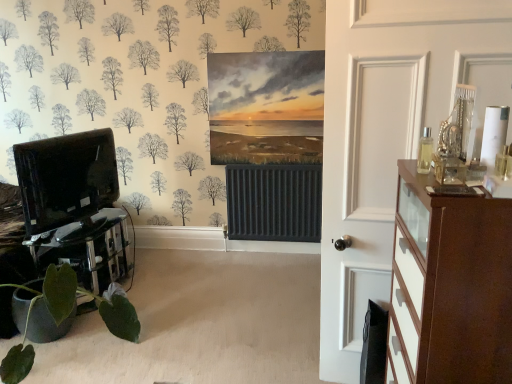
Question: Can you confirm if black glass table at lower left is wider than green matte plant at lower left?

Choices:
 (A) no
 (B) yes

Answer: (A)

Question: Considering the relative sizes of black glass table at lower left and green matte plant at lower left in the image provided, is black glass table at lower left taller than green matte plant at lower left?

Choices:
 (A) yes
 (B) no

Answer: (B)

Question: From the image's perspective, would you say black glass table at lower left is positioned over green matte plant at lower left?

Choices:
 (A) no
 (B) yes

Answer: (B)

Question: Is black glass table at lower left directly adjacent to green matte plant at lower left?

Choices:
 (A) yes
 (B) no

Answer: (B)

Question: Considering the relative sizes of black glass table at lower left and green matte plant at lower left in the image provided, is black glass table at lower left thinner than green matte plant at lower left?

Choices:
 (A) yes
 (B) no

Answer: (A)

Question: From a real-world perspective, is black glass table at lower left on top of green matte plant at lower left?

Choices:
 (A) yes
 (B) no

Answer: (B)

Question: Is brown wood chest of drawers at right next to black glossy entertainment center at left?

Choices:
 (A) no
 (B) yes

Answer: (A)

Question: Is black glossy entertainment center at left at the back of brown wood chest of drawers at right?

Choices:
 (A) yes
 (B) no

Answer: (B)

Question: Is brown wood chest of drawers at right smaller than black glossy entertainment center at left?

Choices:
 (A) yes
 (B) no

Answer: (B)

Question: Is brown wood chest of drawers at right shorter than black glossy entertainment center at left?

Choices:
 (A) yes
 (B) no

Answer: (B)

Question: From the image's perspective, is brown wood chest of drawers at right on black glossy entertainment center at left?

Choices:
 (A) yes
 (B) no

Answer: (B)

Question: Does brown wood chest of drawers at right appear on the right side of black glossy entertainment center at left?

Choices:
 (A) no
 (B) yes

Answer: (B)

Question: Is black glass table at lower left surrounded by green matte plant at lower left?

Choices:
 (A) no
 (B) yes

Answer: (A)